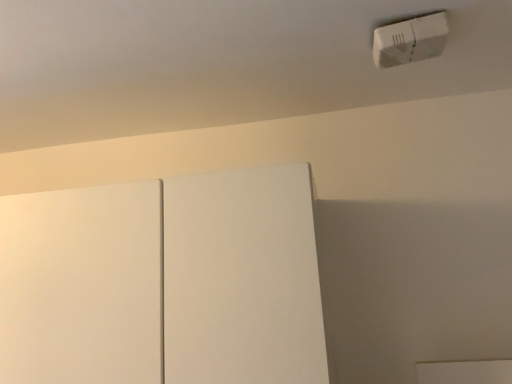
Describe the element at coordinates (410, 40) in the screenshot. I see `white plastic light switch at upper right` at that location.

Locate an element on the screen. The height and width of the screenshot is (384, 512). white plastic light switch at upper right is located at coordinates (410, 40).

Identify the location of white plastic light switch at upper right. The image size is (512, 384). (410, 40).